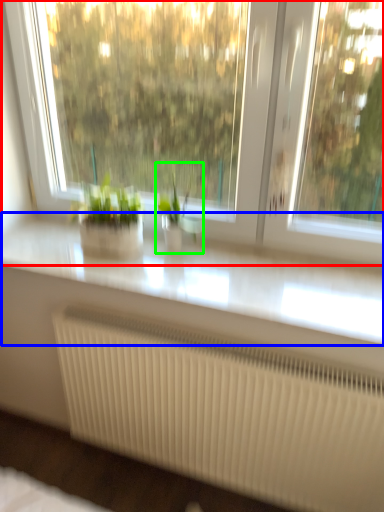
Question: Considering the real-world distances, which object is closest to window (highlighted by a red box)? counter top (highlighted by a blue box) or houseplant (highlighted by a green box).

Choices:
 (A) counter top
 (B) houseplant

Answer: (A)